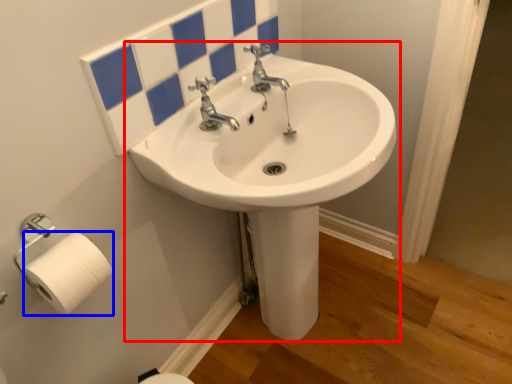
Question: Which of the following is the closest to the observer, sink (highlighted by a red box) or toilet paper (highlighted by a blue box)?

Choices:
 (A) sink
 (B) toilet paper

Answer: (A)